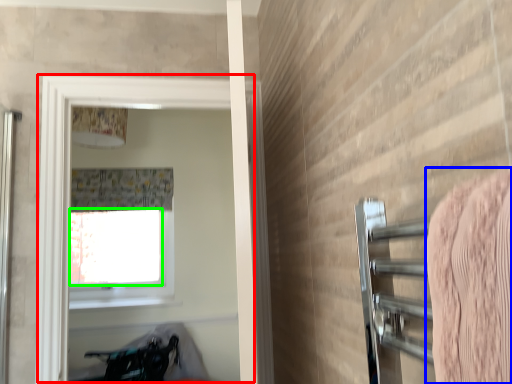
Question: Estimate the real-world distances between objects in this image. Which object is closer to screen door (highlighted by a red box), bath towel (highlighted by a blue box) or window screen (highlighted by a green box)?

Choices:
 (A) bath towel
 (B) window screen

Answer: (B)